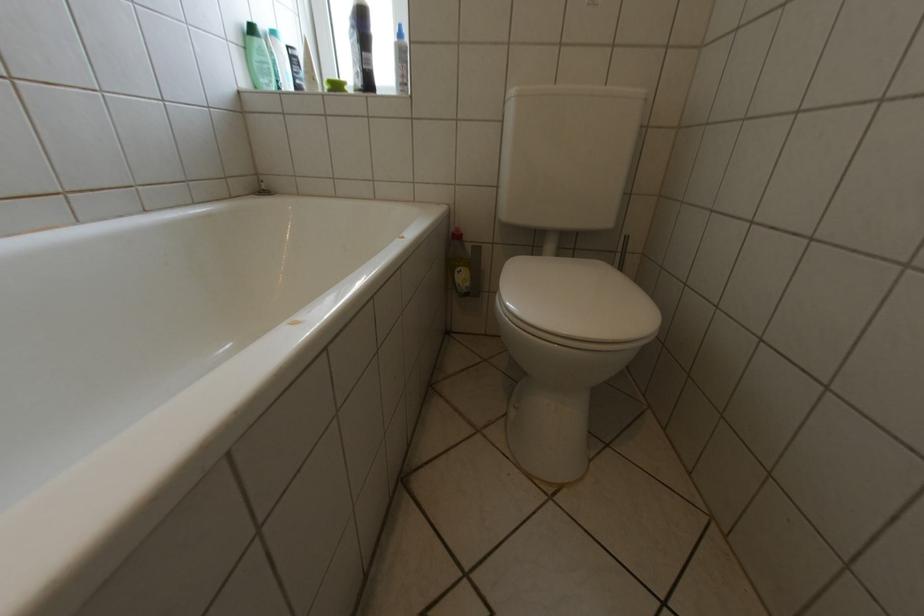
Where would you lift the yellow cleaning bottle? Please return your answer as a coordinate pair (x, y).

(457, 264)